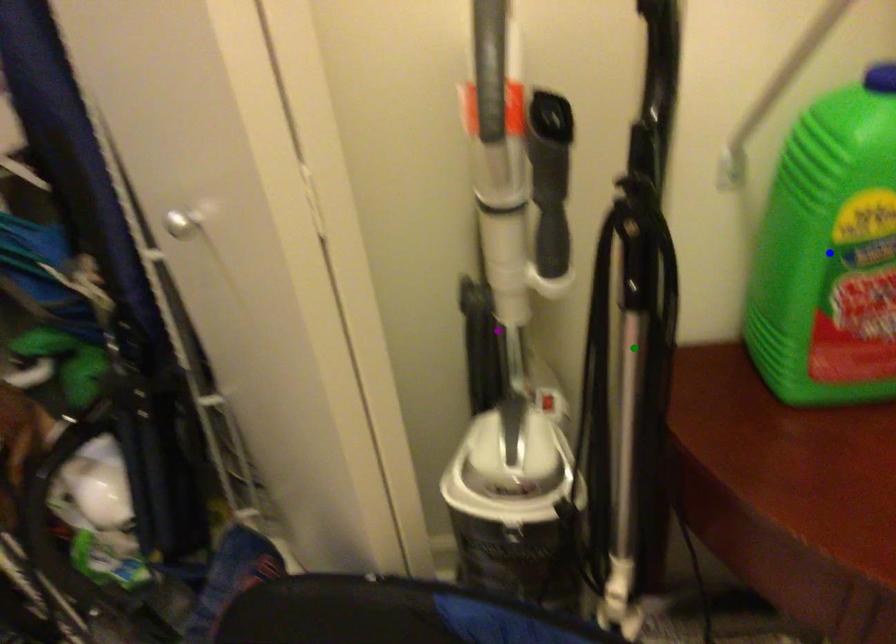
Order these from nearest to farthest:
- green point
- blue point
- purple point

green point, blue point, purple point